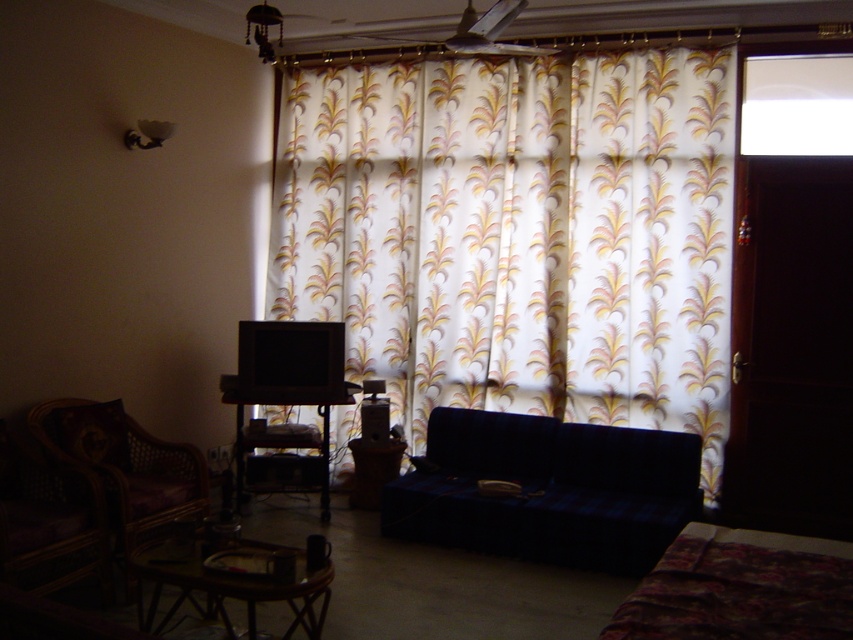
Is velvet blue couch at center thinner than wooden table at lower center?

No.

Which of these two, velvet blue couch at center or wooden table at lower center, stands taller?

With more height is velvet blue couch at center.

This screenshot has height=640, width=853. Identify the location of velvet blue couch at center. (548, 490).

Who is higher up, velvet blue couch at center or matte white lampshade at upper left?

matte white lampshade at upper left is above.

The width and height of the screenshot is (853, 640). I want to click on velvet blue couch at center, so click(548, 490).

You are a GUI agent. You are given a task and a screenshot of the screen. Output one action in this format:
    pyautogui.click(x=<x>, y=<y>)
    Task: Click on the velvet blue couch at center
    The width and height of the screenshot is (853, 640).
    Given the screenshot: What is the action you would take?
    pyautogui.click(x=548, y=490)

Is the position of white printed fabric curtain at center more distant than that of matte white lampshade at upper left?

Yes, it is.

Does point (601, 276) come closer to viewer compared to point (140, 122)?

No, it is not.

Find the location of a particular element. This screenshot has height=640, width=853. white printed fabric curtain at center is located at coordinates (518, 234).